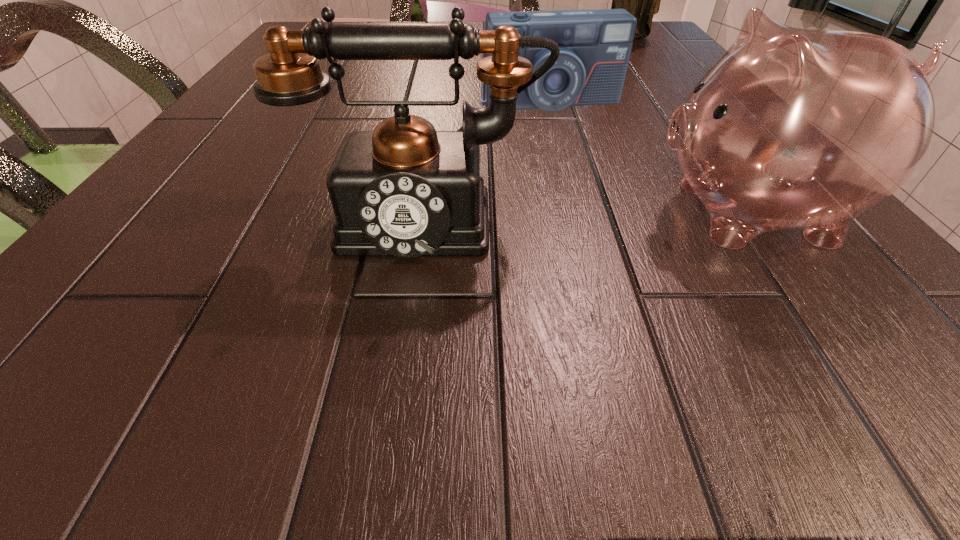
Find the location of `unoccupied position between the shortest object and the piggy bank`. unoccupied position between the shortest object and the piggy bank is located at coordinates (647, 157).

Locate an element on the screen. empty space that is in between the tallest object and the telephone is located at coordinates (525, 126).

Identify the location of object that is the third closest to the piggy bank. (642, 0).

Locate which object ranks second in proximity to the piggy bank. Please provide its 2D coordinates. Your answer should be formatted as a tuple, i.e. [(x, y)], where the tuple contains the x and y coordinates of a point satisfying the conditions above.

[(595, 46)]

Locate an element on the screen. This screenshot has height=540, width=960. free location that satisfies the following two spatial constraints: 1. on the back side of the third nearest object; 2. on the right side of the tallest object is located at coordinates (532, 37).